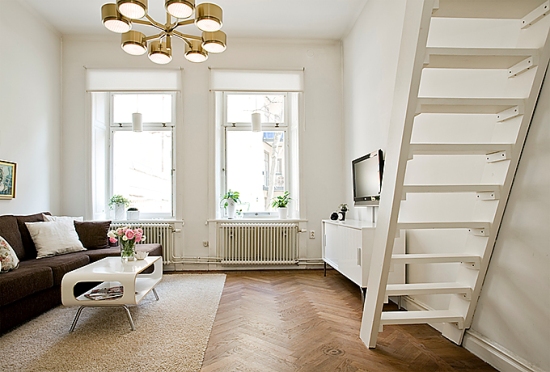
Locate an element on the screen. This screenshot has width=550, height=372. living room is located at coordinates (225, 253).